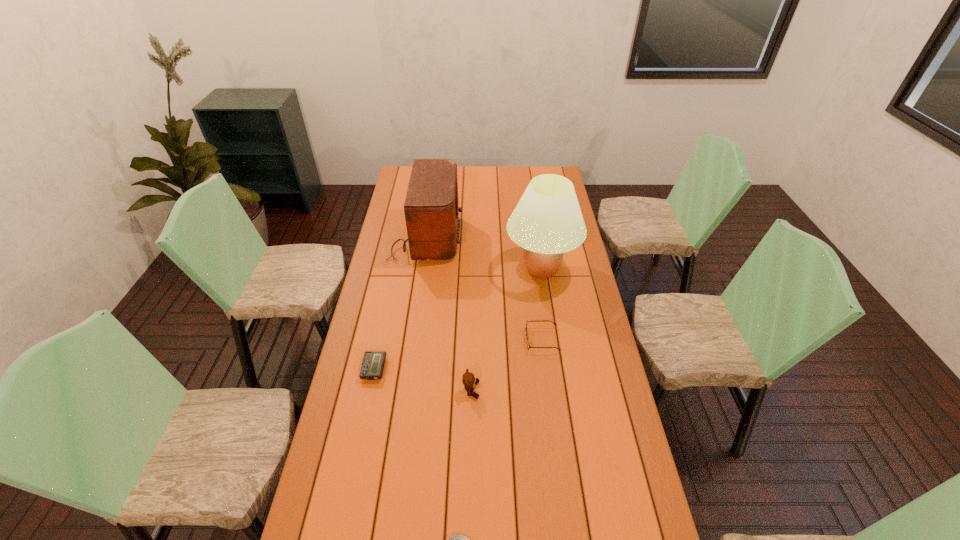
Locate an element on the screen. blank space that satisfies the following two spatial constraints: 1. on the shade of the tallest object; 2. on the front side of the beeper is located at coordinates (557, 369).

Find the location of a particular element. This screenshot has height=540, width=960. free space in the image that satisfies the following two spatial constraints: 1. on the lenses of the spectacles; 2. on the front side of the beeper is located at coordinates (546, 369).